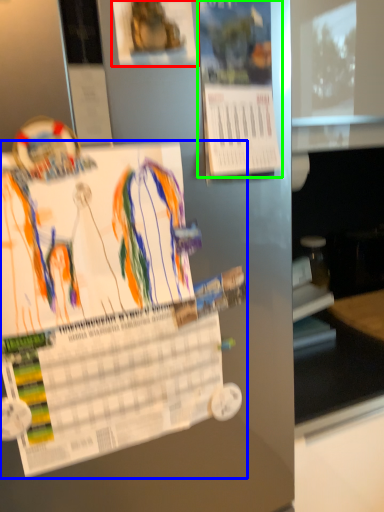
Question: Which is nearer to the poster (highlighted by a red box)? poster (highlighted by a blue box) or poster (highlighted by a green box).

Choices:
 (A) poster
 (B) poster

Answer: (B)